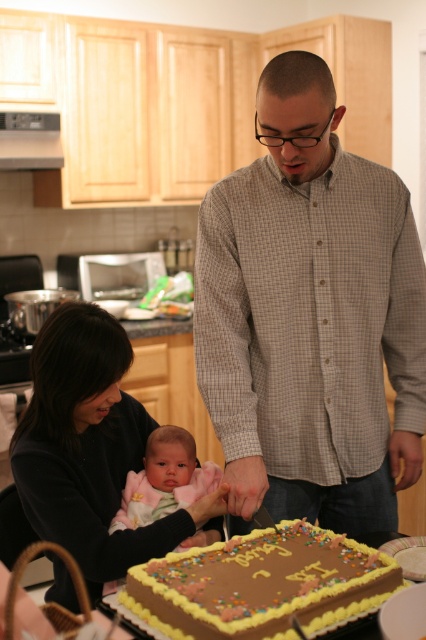
You are a photographer positioned in front of the kitchen scene. You need to capture a photo that includes both the checkered shirt at center and the chocolate frosted cake at center. Which object should you focus on first to ensure both are in frame?

You should focus on the checkered shirt at center first because it is closer to you than the chocolate frosted cake at center, ensuring both are in frame.

You are a guest at the celebration and want to take a photo of the man cutting the cake. Which object should you focus on first, the checkered shirt at center or the chocolate frosted cake at center, to ensure both are in the frame?

You should focus on the chocolate frosted cake at center first because the checkered shirt at center is to the right of it, so centering the cake will allow the shirt to be included in the frame as well.